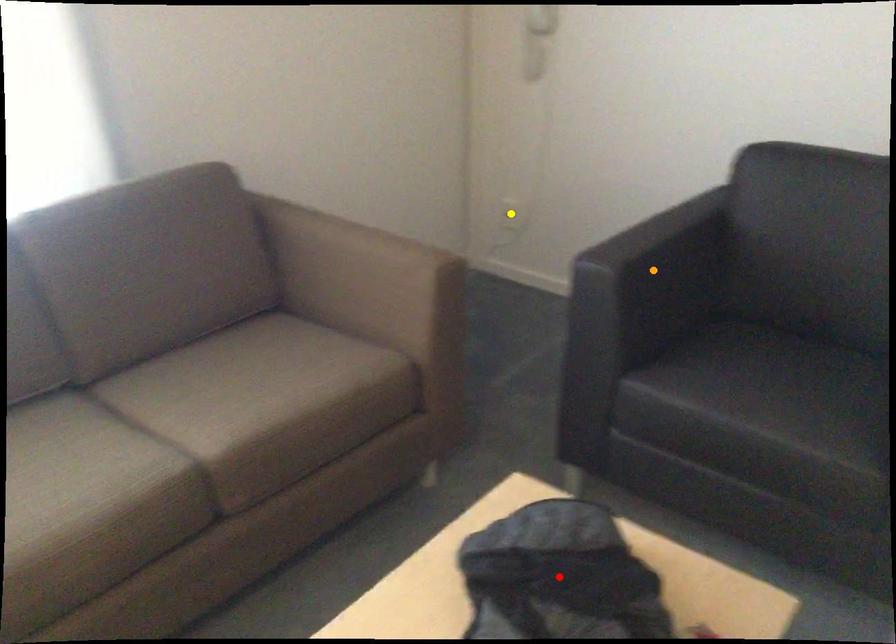
Order these from nearest to farthest:
yellow point | orange point | red point

red point < orange point < yellow point